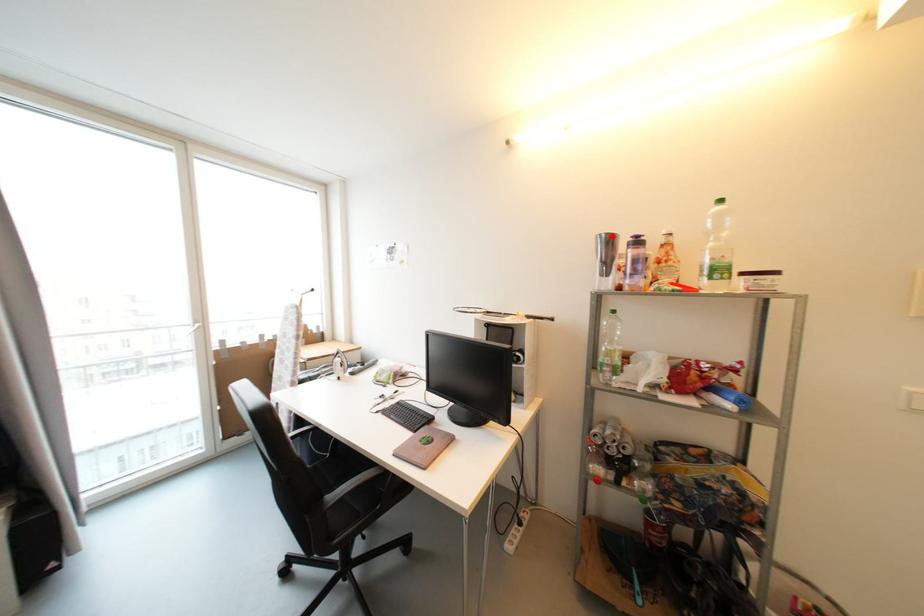
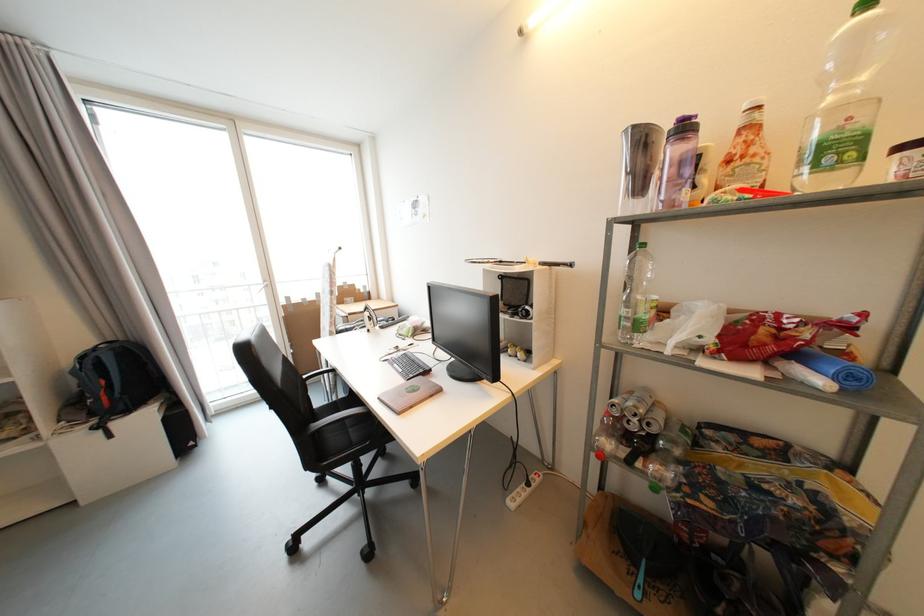
Find the pixel in the second image that matches the highlighted location in the first image.

(639, 129)